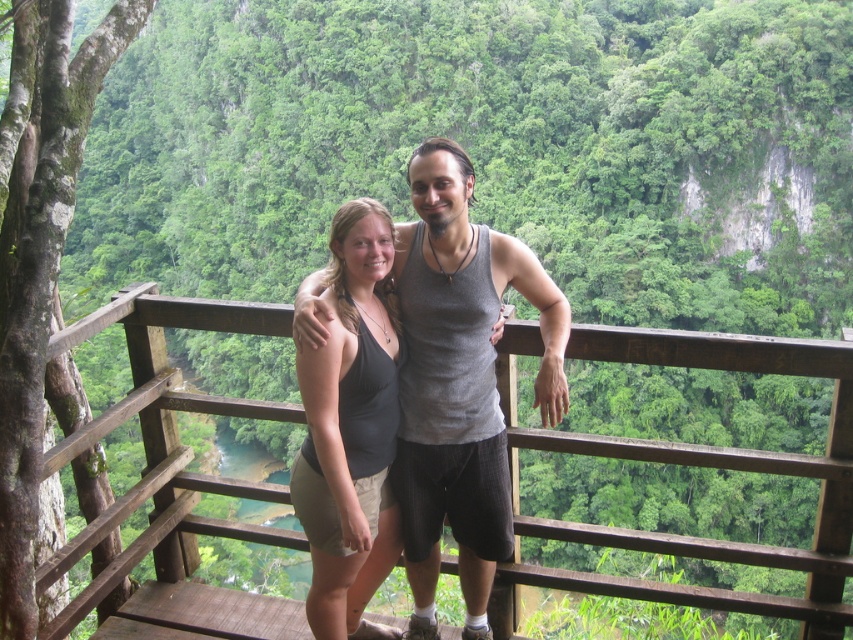
You are a photographer trying to capture a photo of the wooden at center and the gray tank top at center. Which object should you focus on first if you want to ensure both are in sharp focus?

Since the wooden at center is wider than the gray tank top at center, you should focus on the wooden at center first to ensure both are in sharp focus.

You are a photographer trying to capture both the gray tank top at center and the black fabric tank top at center in a single frame. Given that the camera can only focus on items within a 1.5 meter width, will both tops fit within the camera frame?

The gray tank top at center is wider than the black fabric tank top at center. However, since the camera can focus on items within a 1.5 meter width, both tops will fit within the frame as long as their combined width does not exceed 1.5 meters. The exact combined width isn